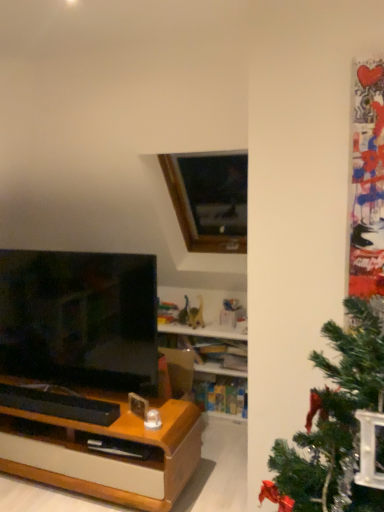
Describe the element at coordinates (79, 318) in the screenshot. I see `matte black television at left` at that location.

At what (x,y) coordinates should I click in order to perform the action: click on matte black television at left. Please return your answer as a coordinate pair (x, y). The width and height of the screenshot is (384, 512). Looking at the image, I should click on (79, 318).

This screenshot has height=512, width=384. In order to click on matte black television at left in this screenshot , I will do `click(79, 318)`.